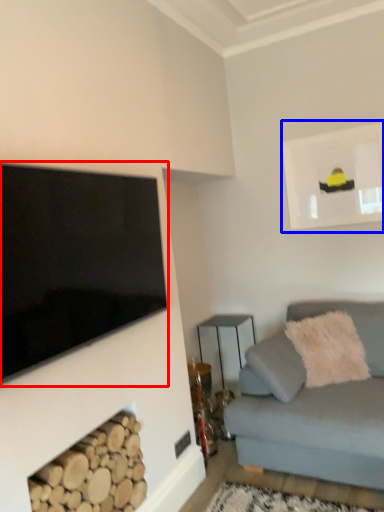
Question: Which object is further to the camera taking this photo, television (highlighted by a red box) or picture frame (highlighted by a blue box)?

Choices:
 (A) television
 (B) picture frame

Answer: (B)